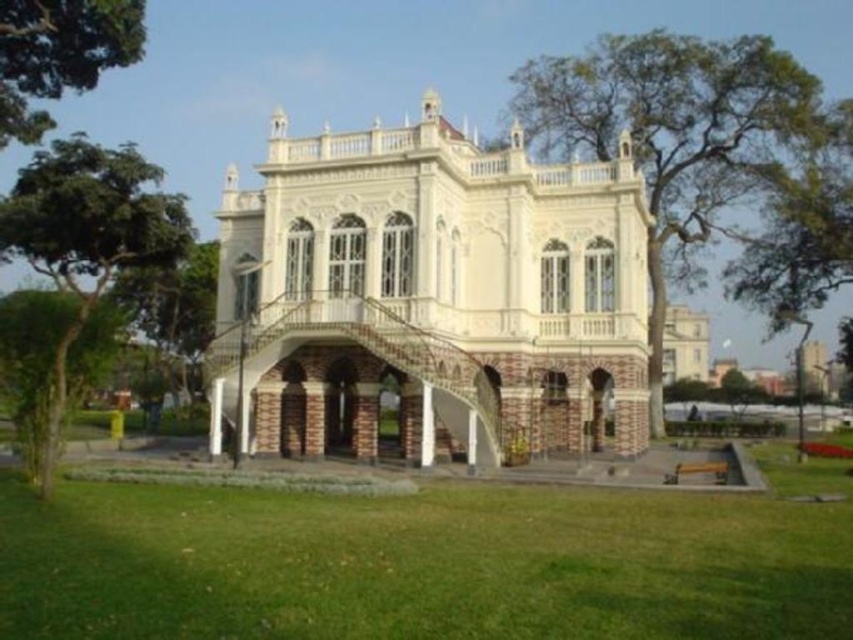
What is located at the coordinates point (432, 296) in the image?

The point (432, 296) indicates the white brick palace at center.

You are standing in the park and looking at the white brick palace at center and the green leafy tree at left. Which one appears taller from your viewpoint?

The green leafy tree at left is taller than the white brick palace at center.